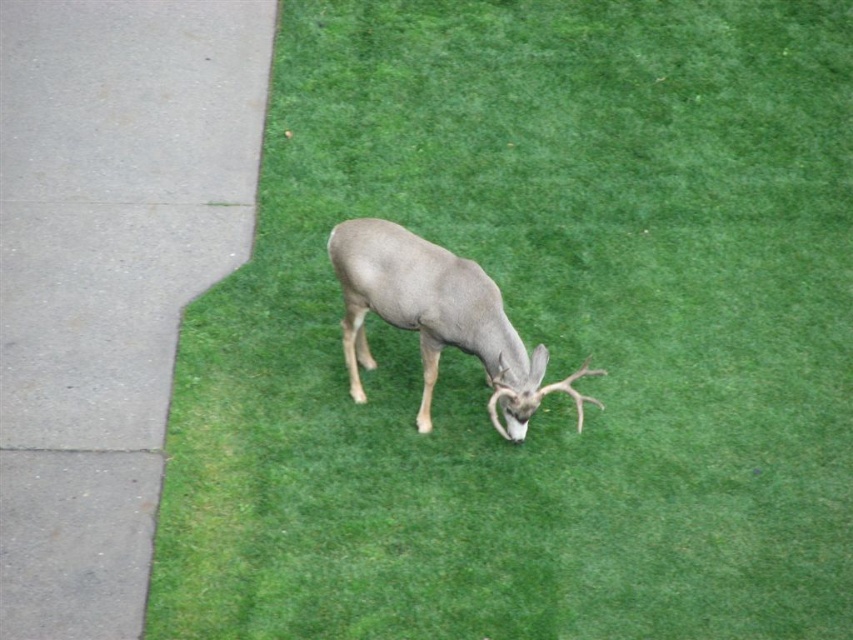
You are a gardener trying to reach the gray concrete pavement at left from the gray matte deer at center. Which direction should you move to get there?

To reach the gray concrete pavement at left from the gray matte deer at center, you should move to the left since the gray concrete pavement at left is positioned to the left of the gray matte deer at center.

You are standing at the edge of the gray concrete pavement at left and want to approach the gray matte deer at center without getting too close. Which direction should you move to stay on the pavement while moving towards the deer?

You should move to the right because the gray concrete pavement at left is closer to the viewer than the gray matte deer at center, so moving right along the pavement will allow you to approach the deer while staying on the pavement.